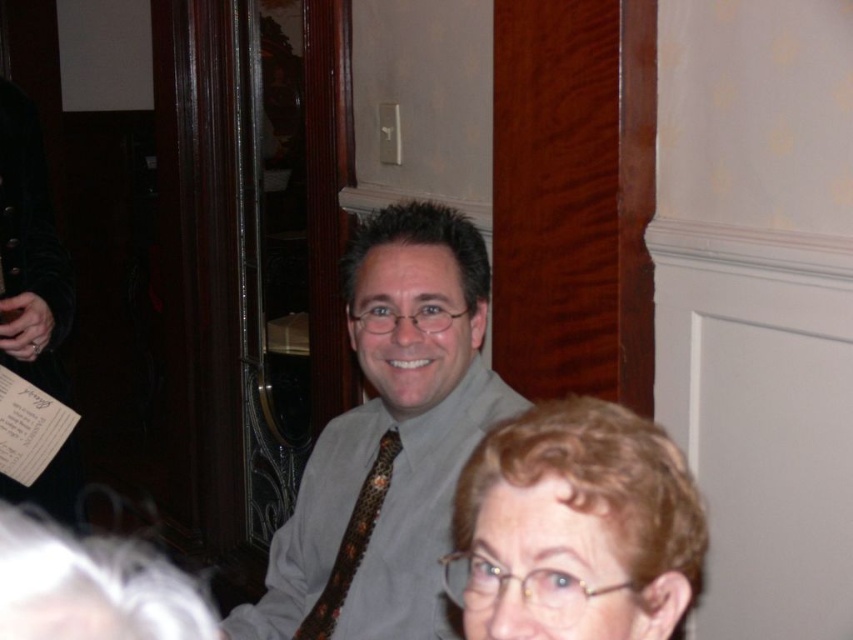
Is the position of matte gray shirt at center more distant than that of leopard print tie at center?

No, matte gray shirt at center is closer to the viewer.

Identify the location of matte gray shirt at center. (389, 442).

Is matte gray shirt at center below light brown hair at lower right?

Actually, matte gray shirt at center is above light brown hair at lower right.

Does matte gray shirt at center lie behind light brown hair at lower right?

That is True.

Where is `matte gray shirt at center`? The height and width of the screenshot is (640, 853). matte gray shirt at center is located at coordinates (389, 442).

Locate an element on the screen. matte gray shirt at center is located at coordinates (389, 442).

Does light brown hair at lower right have a larger size compared to leopard print tie at center?

Yes, light brown hair at lower right is bigger than leopard print tie at center.

Does light brown hair at lower right have a greater height compared to leopard print tie at center?

No.

Between point (639, 525) and point (361, 490), which one is positioned behind?

The point (361, 490) is behind.

Image resolution: width=853 pixels, height=640 pixels. Find the location of `light brown hair at lower right`. light brown hair at lower right is located at coordinates (576, 525).